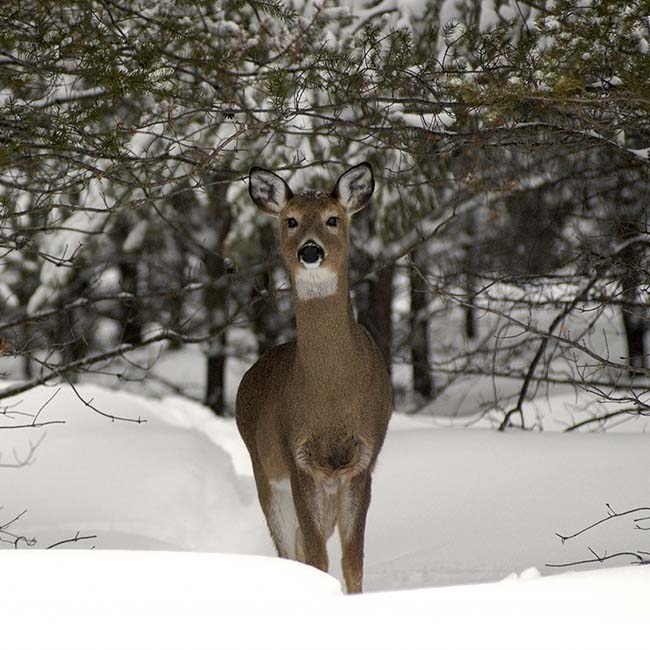
The width and height of the screenshot is (650, 650). In order to click on chest in this screenshot , I will do `click(328, 435)`.